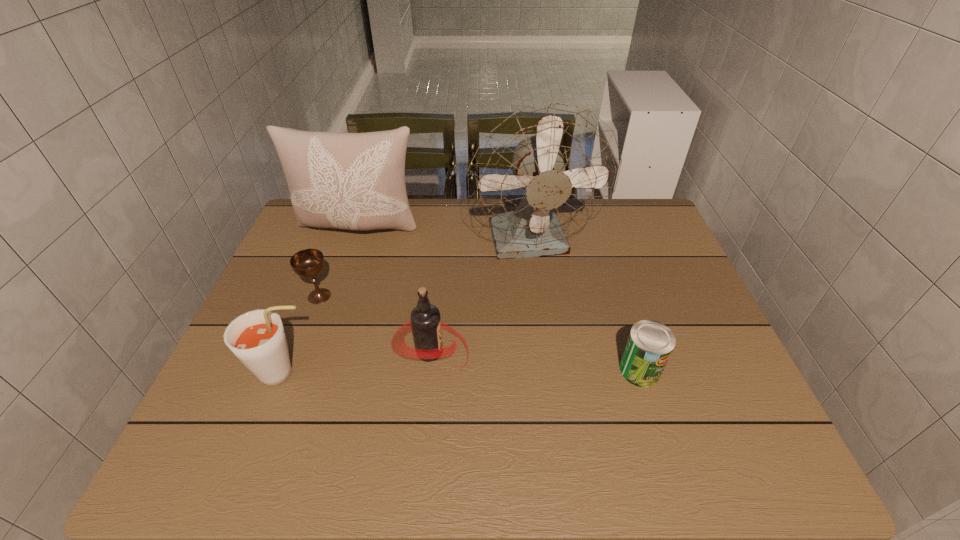
This screenshot has width=960, height=540. Identify the location of vacant space positioned 0.240m on the back of the third farthest object. (343, 233).

I want to click on free point located 0.100m on the front of the can, so click(x=659, y=429).

Where is `fan that is at the far edge`? This screenshot has width=960, height=540. fan that is at the far edge is located at coordinates (543, 173).

In order to click on cushion located at the far edge in this screenshot , I will do `click(356, 181)`.

Identify the location of cushion at the left edge. The image size is (960, 540). (356, 181).

What are the coordinates of `root beer located at the left edge` in the screenshot? It's located at (257, 338).

The image size is (960, 540). In order to click on chalice at the left edge in this screenshot , I will do `click(306, 263)`.

Find the location of a particular element. The image size is (960, 540). object present at the far left corner is located at coordinates (356, 181).

This screenshot has width=960, height=540. Find the location of `vacant space at the far edge`. vacant space at the far edge is located at coordinates (430, 237).

Where is `vacant area at the right edge of the desktop`? The height and width of the screenshot is (540, 960). vacant area at the right edge of the desktop is located at coordinates (730, 375).